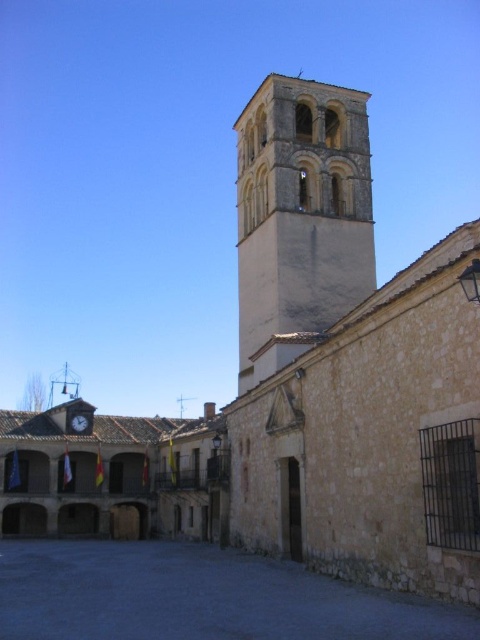
The width and height of the screenshot is (480, 640). Describe the element at coordinates (300, 214) in the screenshot. I see `white stone tower at center` at that location.

Is white stone tower at center taller than metallic clock at center?

Indeed, white stone tower at center has a greater height compared to metallic clock at center.

Locate an element on the screen. white stone tower at center is located at coordinates (300, 214).

Find the location of a particular element. white stone tower at center is located at coordinates (300, 214).

Who is more distant from viewer, (2,573) or (90,428)?

Positioned behind is point (90,428).

Does point (54, 616) come in front of point (91, 422)?

Yes, point (54, 616) is closer to viewer.

At what (x,y) coordinates should I click in order to perform the action: click on dark stone alley at lower left. Please return your answer as a coordinate pair (x, y). Looking at the image, I should click on (199, 596).

Does dark stone alley at lower left appear over white stone tower at center?

No, dark stone alley at lower left is not above white stone tower at center.

Identify the location of dark stone alley at lower left. (199, 596).

The width and height of the screenshot is (480, 640). Identify the location of dark stone alley at lower left. (199, 596).

The height and width of the screenshot is (640, 480). I want to click on dark stone alley at lower left, so click(x=199, y=596).